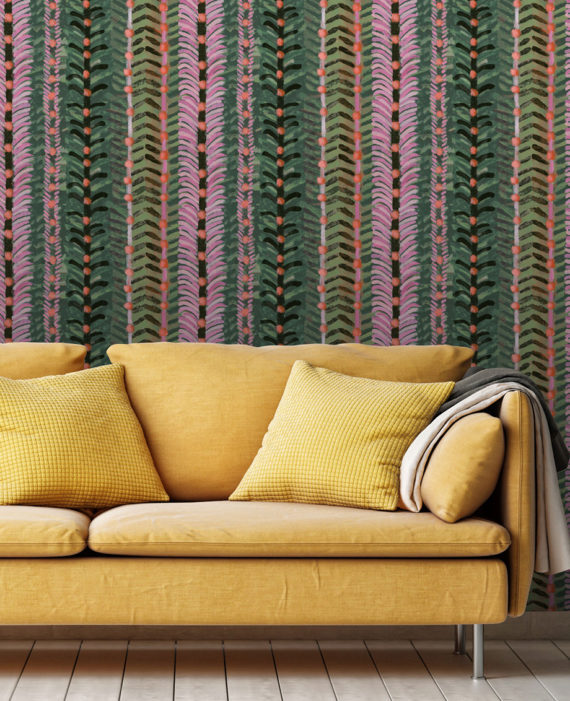
You are a GUI agent. You are given a task and a screenshot of the screen. Output one action in this format:
    pyautogui.click(x=<x>, y=<y>)
    Task: Click on the floor
    The image size is (570, 701).
    Given the screenshot: What is the action you would take?
    pyautogui.click(x=215, y=694)